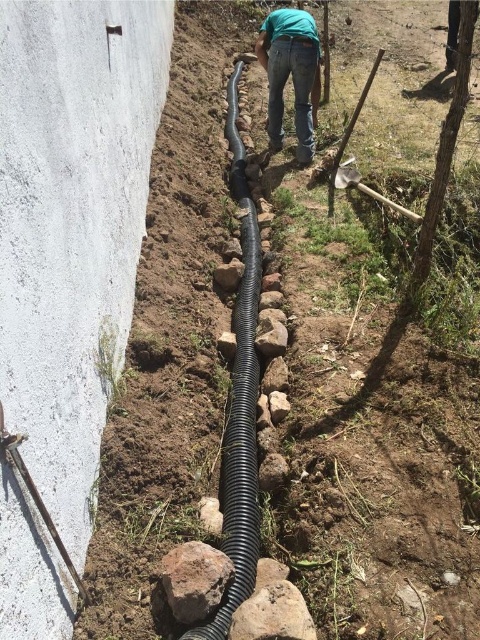
Is point (316, 83) in front of point (188, 570)?

That is False.

Can you confirm if green denim jeans at center is positioned below brown rough rock at center?

No, green denim jeans at center is not below brown rough rock at center.

Image resolution: width=480 pixels, height=640 pixels. What do you see at coordinates (290, 74) in the screenshot? I see `green denim jeans at center` at bounding box center [290, 74].

Locate an element on the screen. This screenshot has height=640, width=480. green denim jeans at center is located at coordinates click(290, 74).

Does black corrugated pipe at center appear under brown rough rock at center?

Actually, black corrugated pipe at center is above brown rough rock at center.

Is black corrugated pipe at center positioned before brown rough rock at center?

Yes, it is in front of brown rough rock at center.

Is point (240, 500) more distant than point (199, 600)?

Yes.

The width and height of the screenshot is (480, 640). I want to click on black corrugated pipe at center, so click(x=240, y=403).

Does point (244, 561) come farther from viewer compared to point (300, 13)?

No, (244, 561) is closer to viewer.

Can you confirm if black corrugated pipe at center is bigger than green denim jeans at center?

Yes, black corrugated pipe at center is bigger than green denim jeans at center.

Locate an element on the screen. This screenshot has height=640, width=480. black corrugated pipe at center is located at coordinates (240, 403).